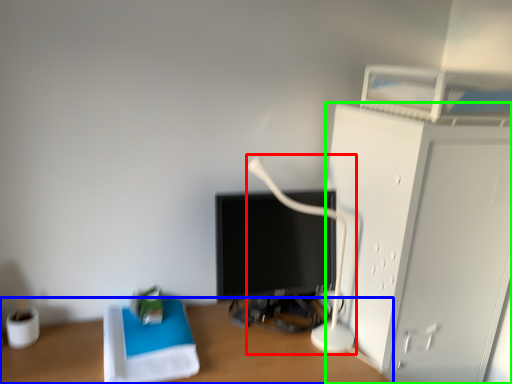
Question: Based on their relative distances, which object is farther from table lamp (highlighted by a red box)? Choose from desk (highlighted by a blue box) and furniture (highlighted by a green box).

Choices:
 (A) desk
 (B) furniture

Answer: (A)